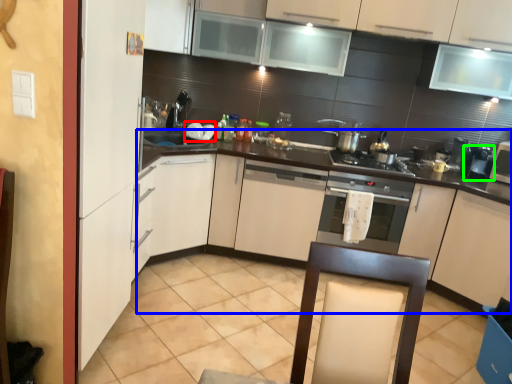
Question: Considering the real-world distances, which object is closest to appliance (highlighted by a red box)? counter (highlighted by a blue box) or coffee machine (highlighted by a green box).

Choices:
 (A) counter
 (B) coffee machine

Answer: (A)